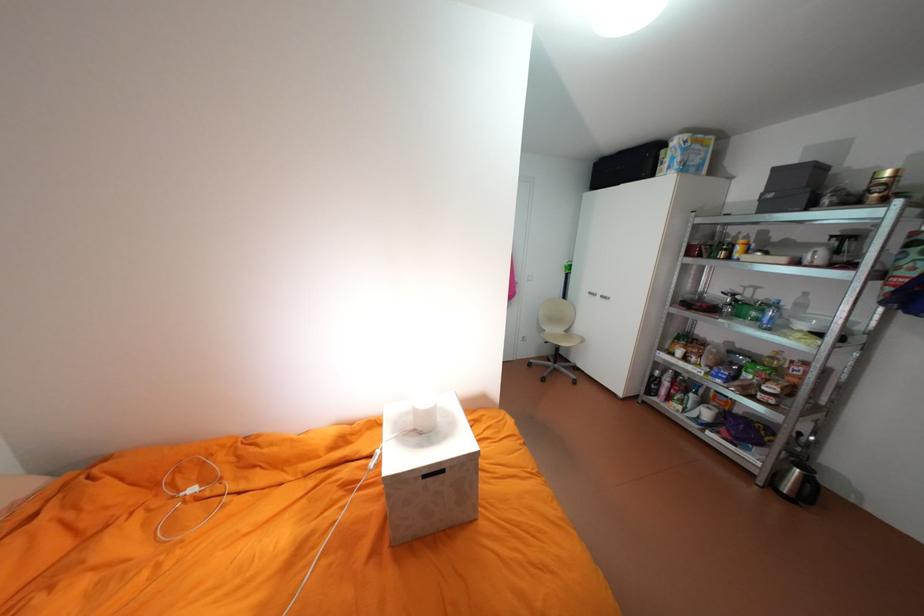
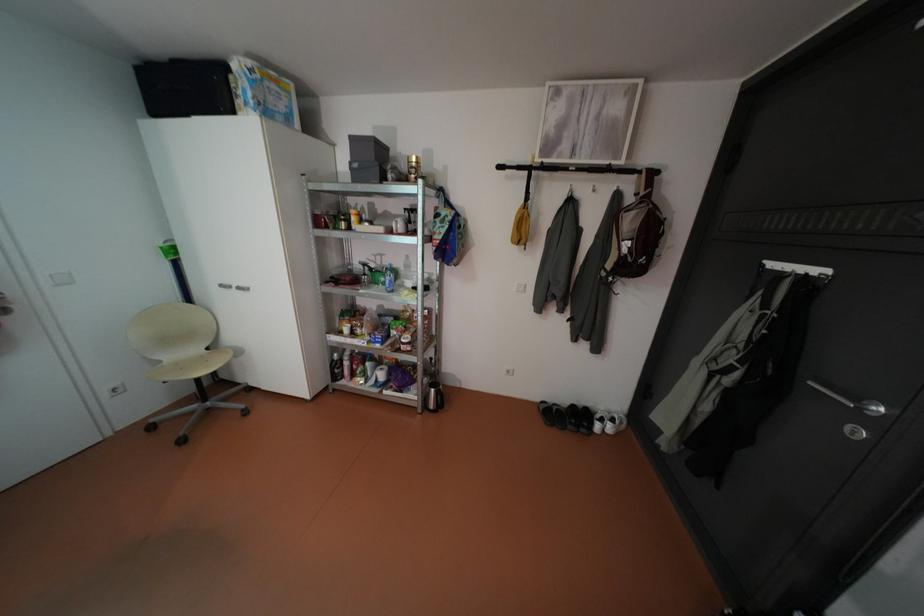
Locate, in the second image, the point that corresponds to (x=795, y=488) in the first image.

(441, 405)